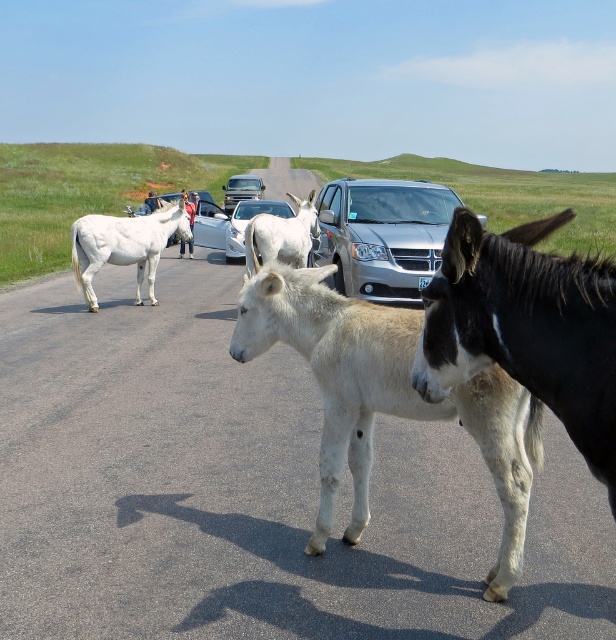
Question: Estimate the real-world distances between objects in this image. Which object is farther from the black glossy mule at center?

Choices:
 (A) metallic silver sedan at center
 (B) metallic silver van at center
 (C) silver metallic sedan at center

Answer: (B)

Question: Where is white matte horse at center located in relation to silver metallic sedan at center in the image?

Choices:
 (A) left
 (B) right

Answer: (B)

Question: Which is nearer to the metallic silver sedan at center?

Choices:
 (A) black glossy mule at center
 (B) denim jacket at center

Answer: (B)

Question: Is metallic silver sedan at center bigger than silver metallic sedan at center?

Choices:
 (A) no
 (B) yes

Answer: (A)

Question: From the image, what is the correct spatial relationship of white fuzzy donkey at center in relation to denim jacket at center?

Choices:
 (A) above
 (B) below

Answer: (B)

Question: Which object appears farthest from the camera in this image?

Choices:
 (A) white matte horse at center
 (B) black glossy mule at center
 (C) silver metallic sedan at center

Answer: (C)